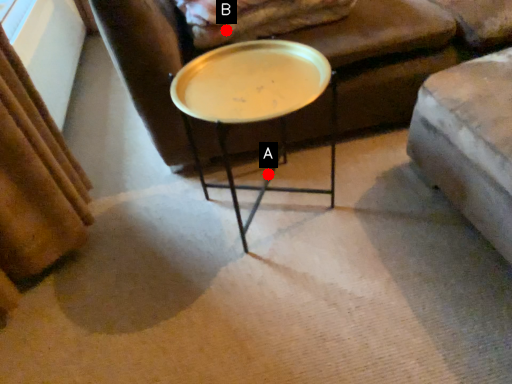
Question: Two points are circled on the image, labeled by A and B beside each circle. Among these points, which one is nearest to the camera?

Choices:
 (A) A is closer
 (B) B is closer

Answer: (B)